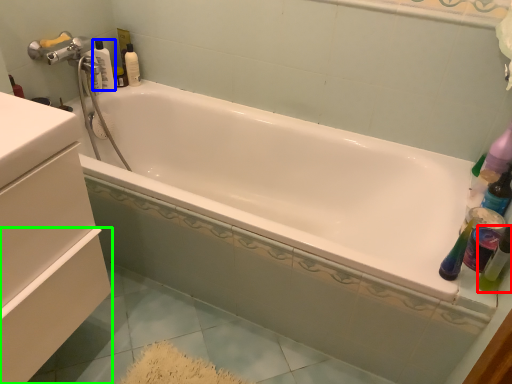
Question: Which object is positioned closest to mouthwash (highlighted by a red box)? Select from bottle (highlighted by a blue box) and drawer (highlighted by a green box).

Choices:
 (A) bottle
 (B) drawer

Answer: (B)